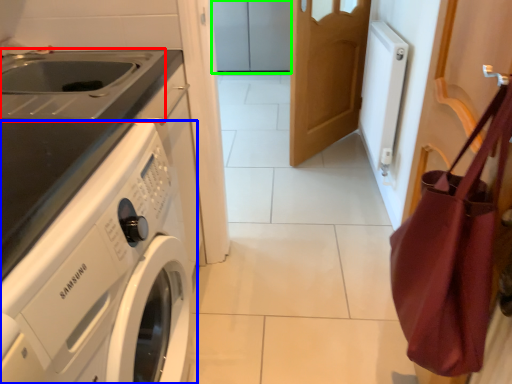
Question: Which object is positioned closest to sink (highlighted by a red box)? Select from washing machine (highlighted by a blue box) and cabinetry (highlighted by a green box).

Choices:
 (A) washing machine
 (B) cabinetry

Answer: (A)